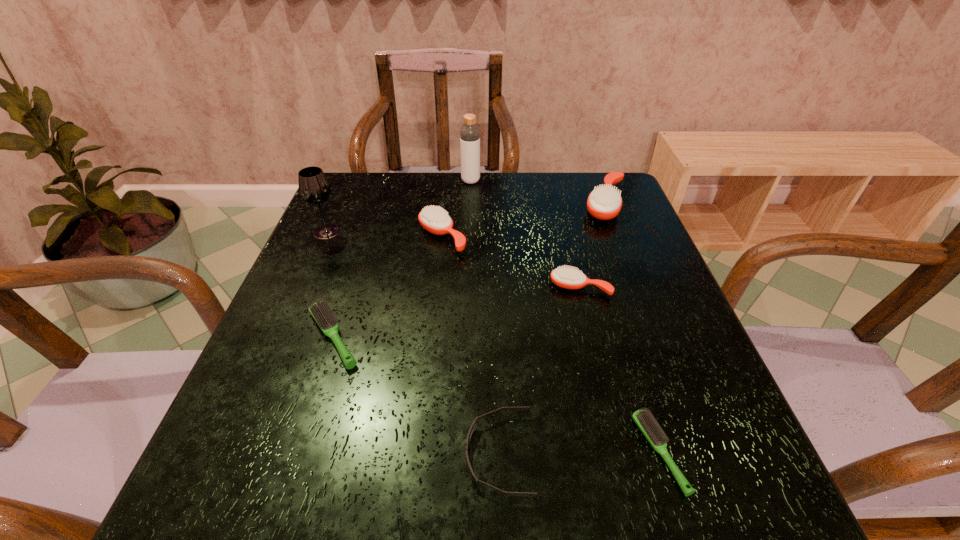
Identify the location of gray bottle. The height and width of the screenshot is (540, 960). (469, 133).

This screenshot has width=960, height=540. I want to click on gray wineglass, so 314,188.

Where is `the seventh shortest object`? the seventh shortest object is located at coordinates (314, 188).

The height and width of the screenshot is (540, 960). I want to click on the third tallest object, so click(605, 202).

This screenshot has width=960, height=540. I want to click on the tallest hairbrush, so click(605, 202).

Where is `the second biggest orange hairbrush`? the second biggest orange hairbrush is located at coordinates (434, 219).

Find the location of a particular element. the second hairbrush from left to right is located at coordinates (434, 219).

Where is `the smallest orange hairbrush`? The width and height of the screenshot is (960, 540). the smallest orange hairbrush is located at coordinates (570, 278).

Identify the location of the nearest orange hairbrush. The height and width of the screenshot is (540, 960). (570, 278).

Locate an element on the screen. the sixth farthest object is located at coordinates (321, 312).